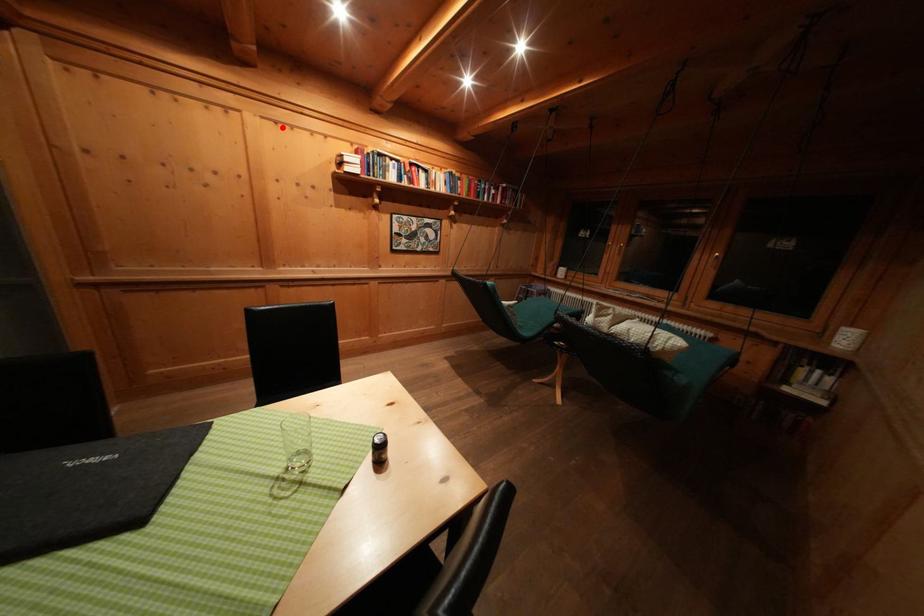
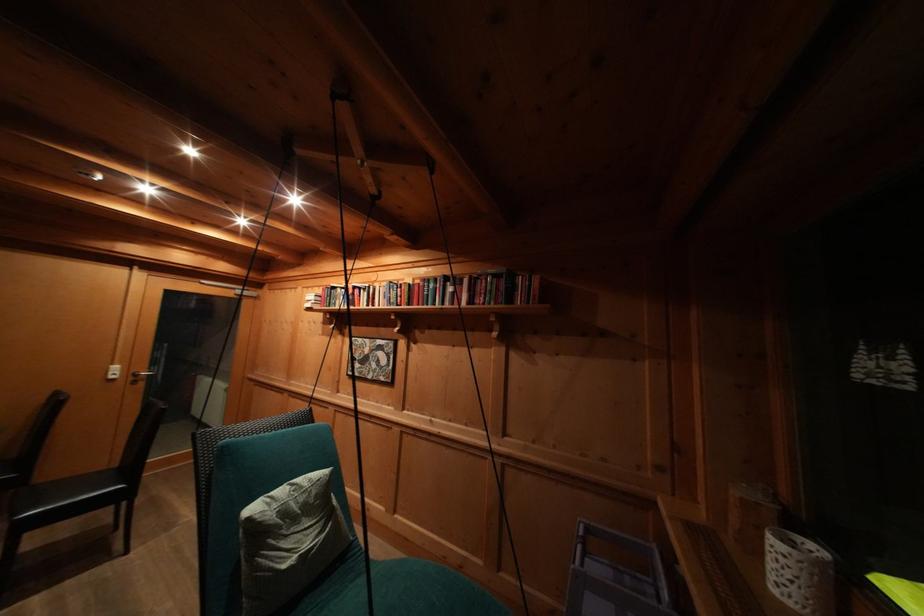
Locate, in the second image, the point that corresponds to the highlighted location in the first image.

(313, 293)